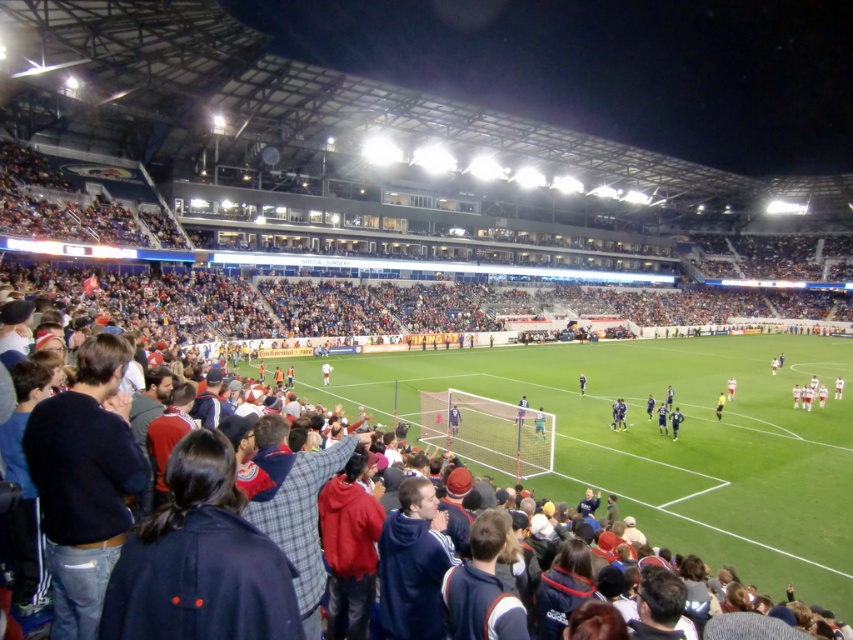
You are a photographer trying to capture a clear shot of the white fabric shirt at center and the yellow uniformed official at center. Which one is more likely to be in focus if you focus on the thinner object?

The white fabric shirt at center is thinner than the yellow uniformed official at center, so focusing on the thinner object would mean the white fabric shirt at center is in focus, while the yellow uniformed official at center may be slightly out of focus.

You are a photographer standing at the edge of the soccer field. You want to take a photo of the green jersey at center. The stadium has a rule that you must stay at least 20 meters away from any player. Is your current position within the allowed distance?

The distance between the green jersey at center and the viewer is 25.09 meters, which is more than the required 20 meters, so your current position is within the allowed distance.